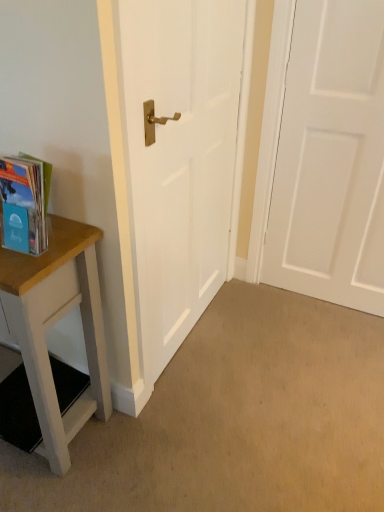
Find the location of a particular element. The width and height of the screenshot is (384, 512). vacant space that is in between white matte door at center, which appears as the 2th door when viewed from the right, and white matte door at right, which appears as the second door when viewed from the left is located at coordinates (266, 331).